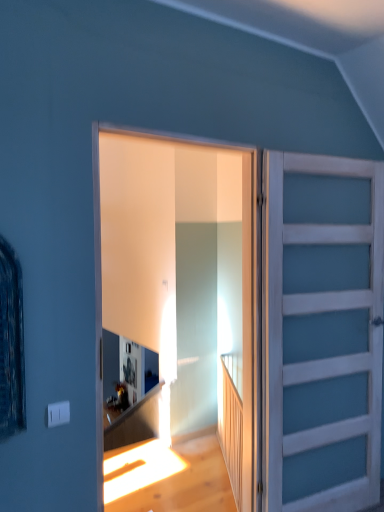
Question: Does point (238, 464) appear closer or farther from the camera than point (316, 339)?

Choices:
 (A) farther
 (B) closer

Answer: (A)

Question: Based on their sizes in the image, would you say wooden at right is bigger or smaller than white painted wood door at right, the 1th door from the right?

Choices:
 (A) small
 (B) big

Answer: (A)

Question: Which is nearer to the wooden at right?

Choices:
 (A) white painted wood door at right, the 2th door when ordered from left to right
 (B) translucent glass door at center, marked as the second door in a right-to-left arrangement

Answer: (B)

Question: Which object is positioned closest to the white painted wood door at right, the 2th door when ordered from left to right?

Choices:
 (A) wooden at right
 (B) translucent glass door at center, which is counted as the 1th door, starting from the left

Answer: (B)